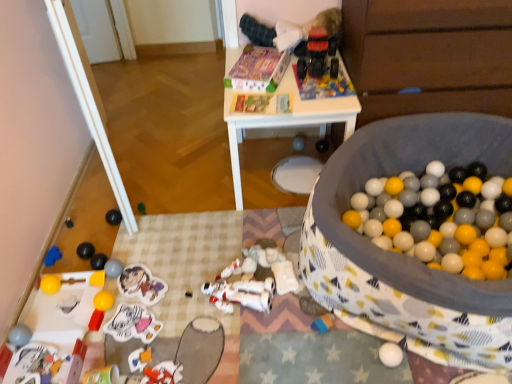
Where is `vacant space to the left of white fabric doll at center, positioned as the seventeenth toy in left-to-right order`? The width and height of the screenshot is (512, 384). vacant space to the left of white fabric doll at center, positioned as the seventeenth toy in left-to-right order is located at coordinates (232, 283).